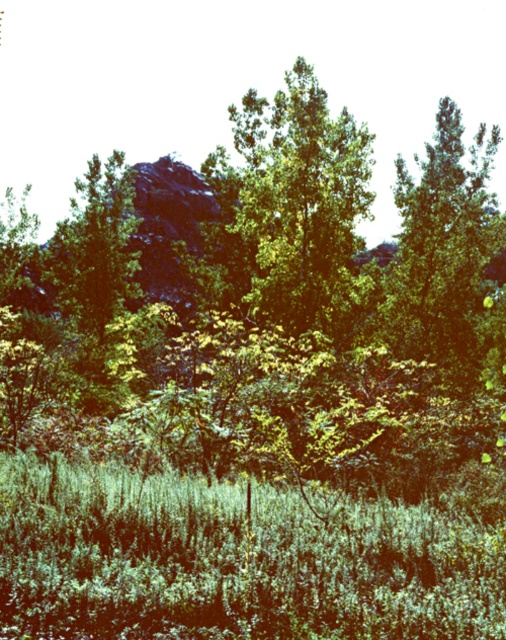
Question: Can you confirm if green leafy grass at lower center is smaller than green leafy tree at center?

Choices:
 (A) no
 (B) yes

Answer: (B)

Question: Which of the following is the closest to the observer?

Choices:
 (A) green leafy grass at lower center
 (B) green leafy tree at center

Answer: (A)

Question: Does green leafy grass at lower center appear over green leafy tree at center?

Choices:
 (A) no
 (B) yes

Answer: (A)

Question: Among these points, which one is nearest to the camera?

Choices:
 (A) (336, 236)
 (B) (5, 556)

Answer: (B)

Question: Considering the relative positions of green leafy grass at lower center and green leafy tree at center in the image provided, where is green leafy grass at lower center located with respect to green leafy tree at center?

Choices:
 (A) left
 (B) right

Answer: (B)